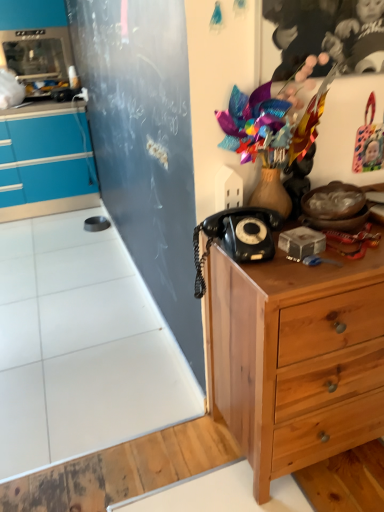
Where is `wooden chest of drawers at right`? The height and width of the screenshot is (512, 384). wooden chest of drawers at right is located at coordinates (295, 357).

The image size is (384, 512). What do you see at coordinates (295, 357) in the screenshot? I see `wooden chest of drawers at right` at bounding box center [295, 357].

The height and width of the screenshot is (512, 384). I want to click on wooden chest of drawers at right, so click(x=295, y=357).